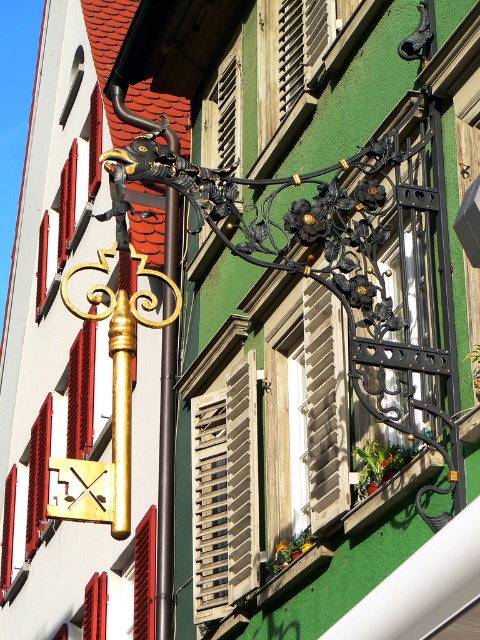
Question: Which point appears farthest from the camera in this image?

Choices:
 (A) (170, 476)
 (B) (91, 115)
 (C) (154, 632)
 (D) (210, 404)

Answer: (B)

Question: Which object is positioned closest to the wooden at center?

Choices:
 (A) matte gold key at left
 (B) red wooden shutter at lower left
 (C) gold polished metal pole at center left

Answer: (C)

Question: From the image, what is the correct spatial relationship of wooden at center in relation to gold polished metal pole at center left?

Choices:
 (A) right
 (B) left

Answer: (A)

Question: Can you confirm if matte gold key at left is positioned to the right of red wooden shutter at lower left?

Choices:
 (A) yes
 (B) no

Answer: (B)

Question: Which object appears farthest from the camera in this image?

Choices:
 (A) gold polished metal pole at center left
 (B) wooden at center

Answer: (A)

Question: Does wooden at center have a larger size compared to matte gold key at left?

Choices:
 (A) no
 (B) yes

Answer: (A)